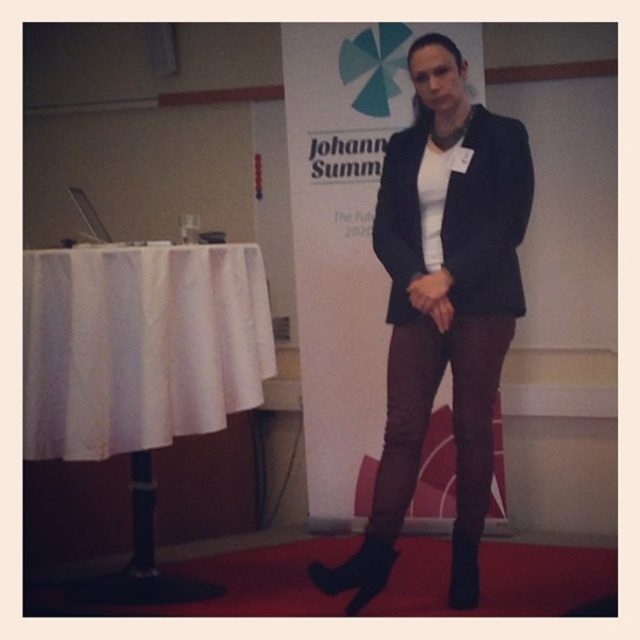
You are a photographer setting up for a portrait session. You need to ensure that the black matte blazer at center and the white cloth at left are positioned so that the blazer is centered in the frame while the white cloth remains out of the main shot. Given their current positions, is this arrangement possible?

The black matte blazer at center is to the right of the white cloth at left. Since the blazer is already positioned to the right of the white cloth, moving the blazer further to the center would require shifting it leftward, which might bring the white cloth into the frame. Therefore, achieving the desired arrangement may not be possible without adjusting the white cloth.